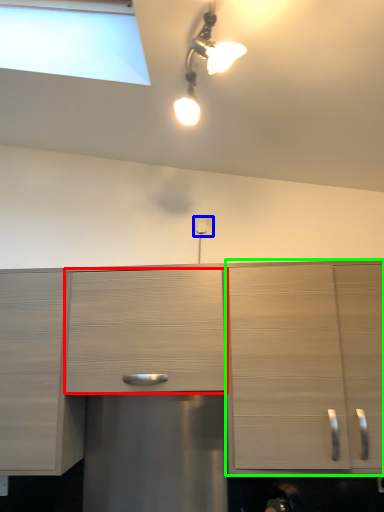
Question: Which is nearer to the drawer (highlighted by a red box)? electric outlet (highlighted by a blue box) or cabinetry (highlighted by a green box).

Choices:
 (A) electric outlet
 (B) cabinetry

Answer: (B)